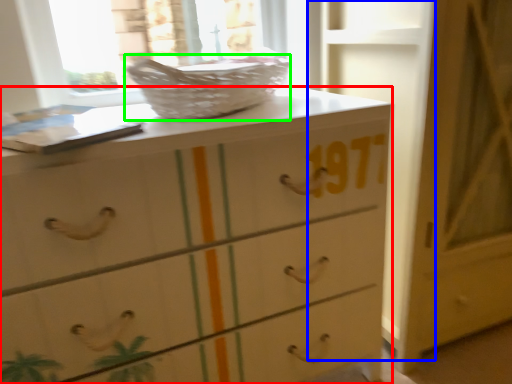
Question: Which object is positioned farthest from chest of drawers (highlighted by a red box)? Select from door (highlighted by a blue box) and basket (highlighted by a green box).

Choices:
 (A) door
 (B) basket

Answer: (A)